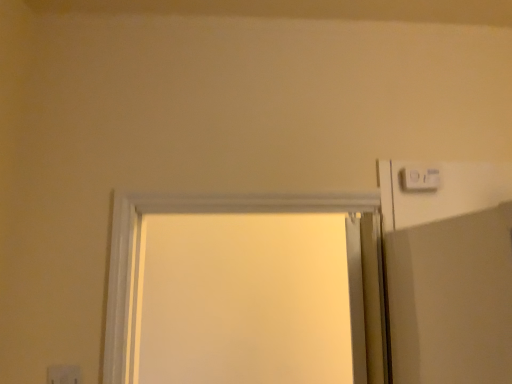
Question: Would you say white plastic electric outlet at lower left is to the left or to the right of white plastic light switch at upper right in the picture?

Choices:
 (A) right
 (B) left

Answer: (B)

Question: From their relative heights in the image, would you say white plastic electric outlet at lower left is taller or shorter than white plastic light switch at upper right?

Choices:
 (A) tall
 (B) short

Answer: (A)

Question: From a real-world perspective, is white plastic electric outlet at lower left physically located above or below white plastic light switch at upper right?

Choices:
 (A) below
 (B) above

Answer: (A)

Question: Is point (420, 182) positioned closer to the camera than point (72, 365)?

Choices:
 (A) farther
 (B) closer

Answer: (A)

Question: Visually, is white plastic light switch at upper right positioned to the left or to the right of white plastic electric outlet at lower left?

Choices:
 (A) left
 (B) right

Answer: (B)

Question: From their relative heights in the image, would you say white plastic light switch at upper right is taller or shorter than white plastic electric outlet at lower left?

Choices:
 (A) short
 (B) tall

Answer: (A)

Question: Considering their positions, is white plastic light switch at upper right located in front of or behind white plastic electric outlet at lower left?

Choices:
 (A) front
 (B) behind

Answer: (B)